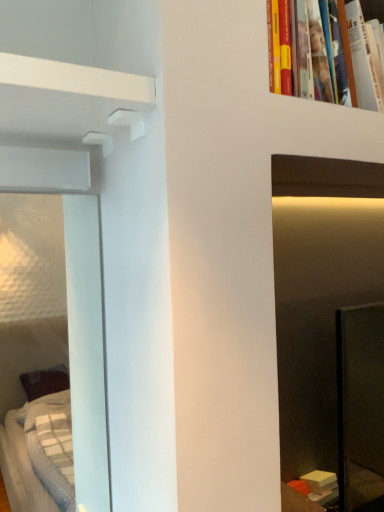
Question: Could you tell me if hardcover book at upper right is turned towards white matte shelf at upper left?

Choices:
 (A) yes
 (B) no

Answer: (B)

Question: Is hardcover book at upper right closer to camera compared to white matte shelf at upper left?

Choices:
 (A) no
 (B) yes

Answer: (A)

Question: Is hardcover book at upper right thinner than white matte shelf at upper left?

Choices:
 (A) no
 (B) yes

Answer: (B)

Question: Is hardcover book at upper right located outside white matte shelf at upper left?

Choices:
 (A) yes
 (B) no

Answer: (A)

Question: Is hardcover book at upper right behind white matte shelf at upper left?

Choices:
 (A) yes
 (B) no

Answer: (A)

Question: Are hardcover book at upper right and white matte shelf at upper left beside each other?

Choices:
 (A) no
 (B) yes

Answer: (A)

Question: From the image's perspective, does white matte shelf at upper left appear higher than hardcover book at upper right?

Choices:
 (A) no
 (B) yes

Answer: (A)

Question: Does white matte shelf at upper left have a lesser width compared to hardcover book at upper right?

Choices:
 (A) yes
 (B) no

Answer: (B)

Question: Is white matte shelf at upper left smaller than hardcover book at upper right?

Choices:
 (A) yes
 (B) no

Answer: (A)

Question: From a real-world perspective, is white matte shelf at upper left located higher than hardcover book at upper right?

Choices:
 (A) no
 (B) yes

Answer: (A)

Question: Is white matte shelf at upper left not within hardcover book at upper right?

Choices:
 (A) no
 (B) yes

Answer: (B)

Question: From the image's perspective, is white matte shelf at upper left under hardcover book at upper right?

Choices:
 (A) no
 (B) yes

Answer: (B)

Question: Choose the correct answer: Is white matte shelf at upper left inside hardcover book at upper right or outside it?

Choices:
 (A) outside
 (B) inside

Answer: (A)